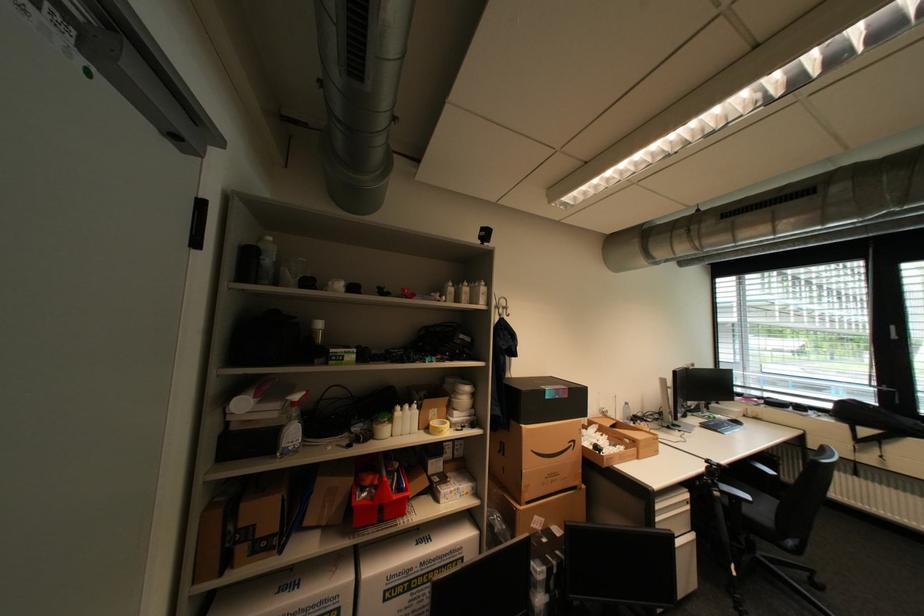
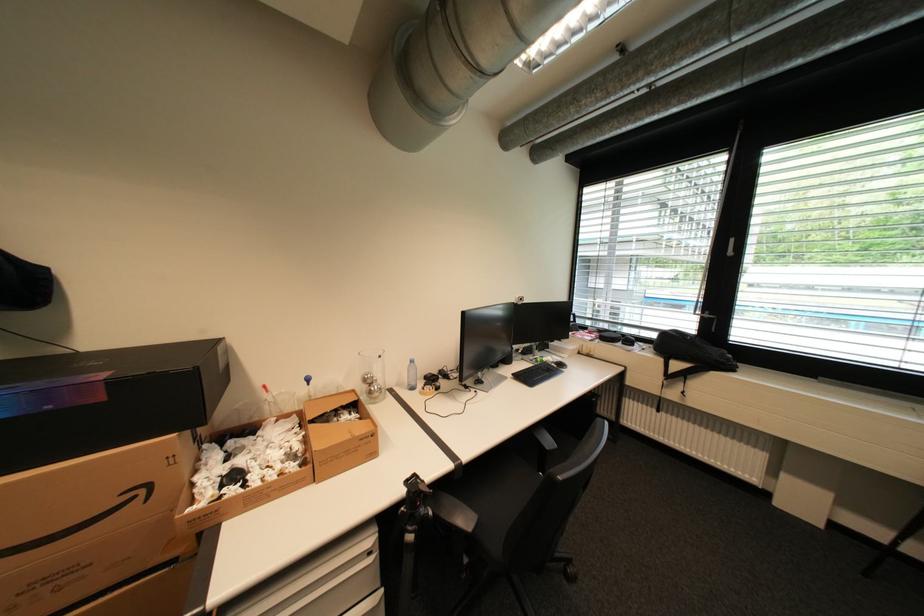
Find the pixel in the second image that matches pixel 869 442 in the first image.

(678, 377)